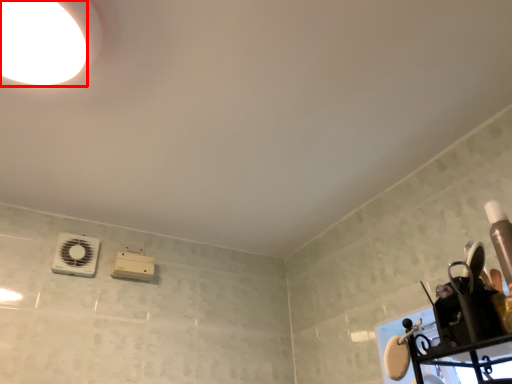
Question: From the image, what is the correct spatial relationship of droplight (annotated by the red box) in relation to appliance?

Choices:
 (A) left
 (B) right

Answer: (B)